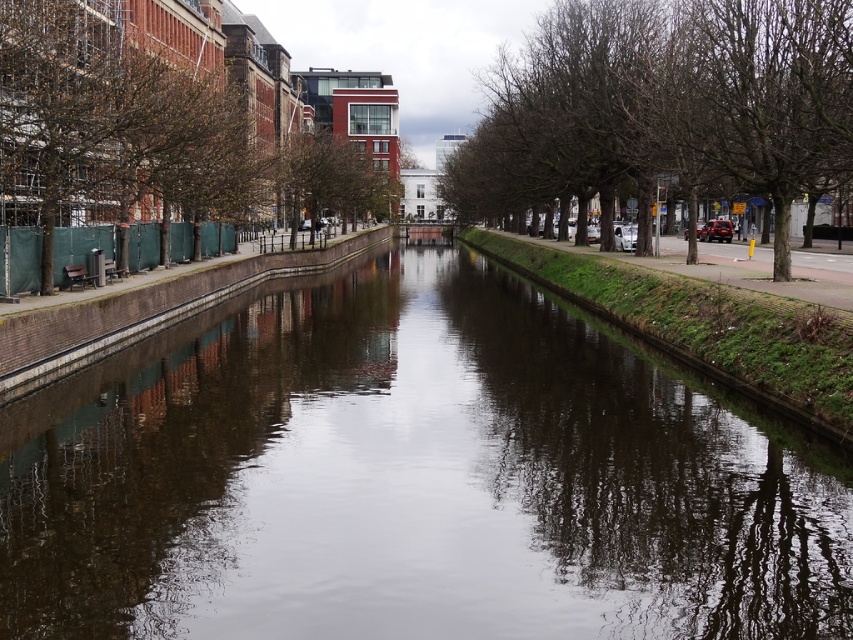
Can you confirm if dark reflective water at center is taller than brown leafy tree at left?

Incorrect, dark reflective water at center's height is not larger of brown leafy tree at left's.

Is point (229, 380) farther from camera compared to point (1, 40)?

Yes.

Does point (457, 516) come in front of point (10, 275)?

Yes, point (457, 516) is closer to viewer.

Locate an element on the screen. This screenshot has width=853, height=640. dark reflective water at center is located at coordinates [x=410, y=477].

Does brown leafy tree at left lie in front of bare branches at right?

No, it is not.

Is brown leafy tree at left positioned behind bare branches at right?

Yes, it is.

You are a GUI agent. You are given a task and a screenshot of the screen. Output one action in this format:
    pyautogui.click(x=<x>, y=<y>)
    Task: Click on the brown leafy tree at left
    This screenshot has height=640, width=853.
    Given the screenshot: What is the action you would take?
    pyautogui.click(x=171, y=134)

What are the coordinates of `brown leafy tree at left` in the screenshot? It's located at (171, 134).

Who is lower down, dark reflective water at center or bare branches at right?

Positioned lower is dark reflective water at center.

Is dark reflective water at center closer to camera compared to bare branches at right?

Yes.

Locate an element on the screen. This screenshot has width=853, height=640. dark reflective water at center is located at coordinates (410, 477).

In order to click on dark reflective water at center in this screenshot , I will do `click(410, 477)`.